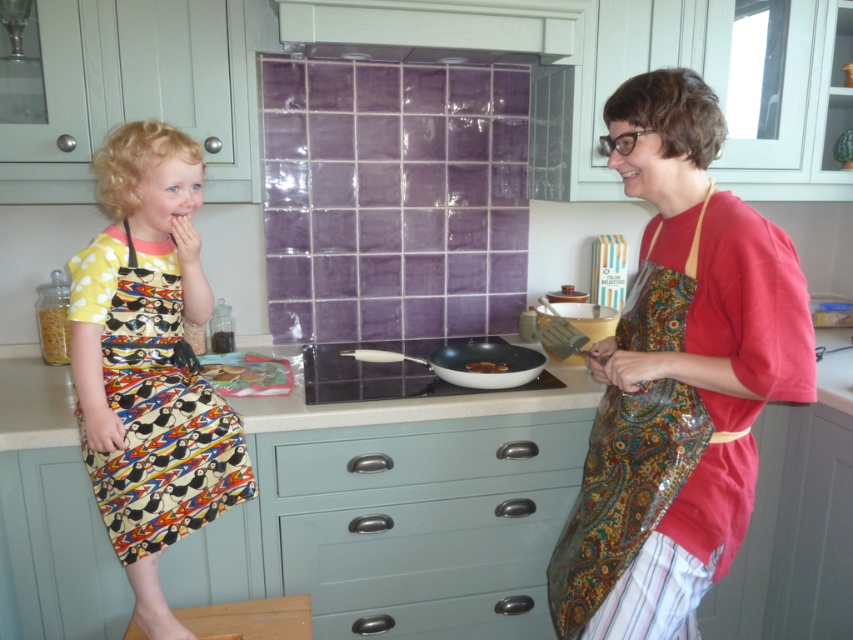
You are a chef trying to find a clean area on the smooth white countertop at center to place a hot pan. The matte red apron at right is in the way. Can you move the apron to access the countertop?

The matte red apron at right is positioned over the smooth white countertop at center, so moving it would allow access to the countertop.

You are standing in the kitchen and see two points marked in the scene. The first point is at coordinate point (497, 576) and the second is at point (444, 605). Which point is closer to you?

Point (497, 576) is further to the viewer than point (444, 605), so the second point is closer to you.

You are standing at the point marked as point (578,598) in the kitchen. You want to reach the refrigerator located 4.23 feet away from your current position. Can you estimate how far you need to walk to get there?

The point marked as point (578,598) is 4.23 feet away from the camera, so you need to walk approximately 4.23 feet to reach the refrigerator.